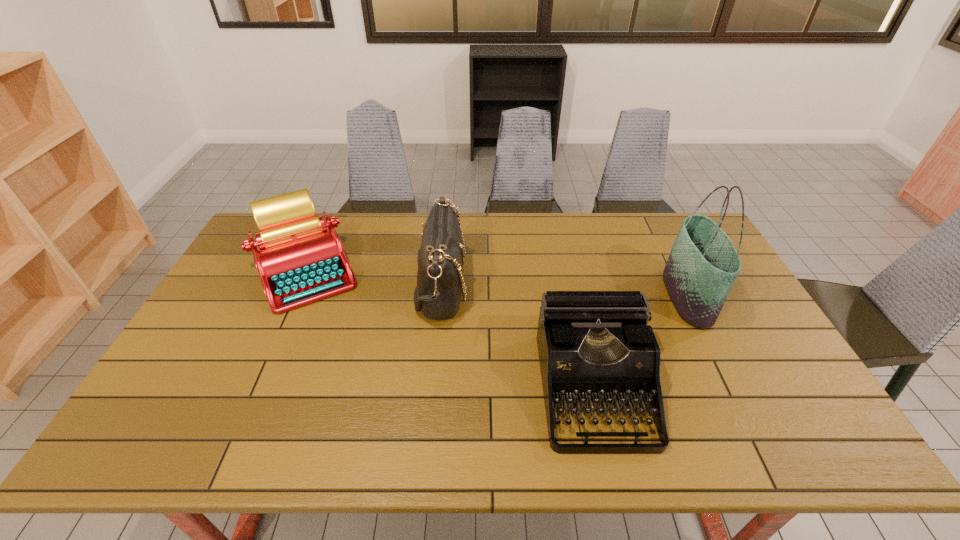
Locate an element on the screen. Image resolution: width=960 pixels, height=540 pixels. vacant region at the right edge of the desktop is located at coordinates (766, 330).

The image size is (960, 540). Find the location of `blank area at the near left corner`. blank area at the near left corner is located at coordinates (190, 445).

Image resolution: width=960 pixels, height=540 pixels. I want to click on unoccupied position between the leftmost object and the third object from right to left, so click(x=373, y=278).

You are a GUI agent. You are given a task and a screenshot of the screen. Output one action in this format:
    pyautogui.click(x=<x>, y=<y>)
    Task: Click on the blank region between the second tallest object and the nearest object
    This screenshot has height=540, width=960.
    Given the screenshot: What is the action you would take?
    pyautogui.click(x=516, y=337)

Where is `free space between the farther typewriter and the rightmost object`? free space between the farther typewriter and the rightmost object is located at coordinates (497, 284).

Find the location of a particular element. Image resolution: width=960 pixels, height=540 pixels. free space between the nearest object and the farther typewriter is located at coordinates (449, 329).

At what (x,y) coordinates should I click in order to perform the action: click on unoccupied area between the rightmost object and the farther typewriter. Please return your answer as a coordinate pair (x, y). Looking at the image, I should click on (497, 284).

The height and width of the screenshot is (540, 960). Identify the location of empty location between the second tallest object and the nearer typewriter. (516, 337).

Identify the location of the second closest object to the leftmost object. The image size is (960, 540). (594, 346).

Identify the location of the third closest object to the right typewriter. click(x=300, y=261).